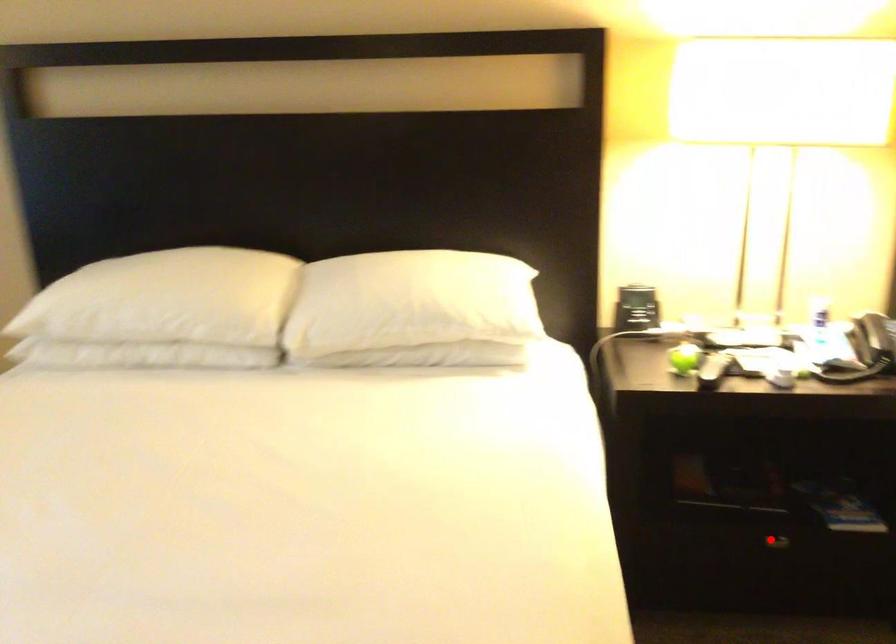
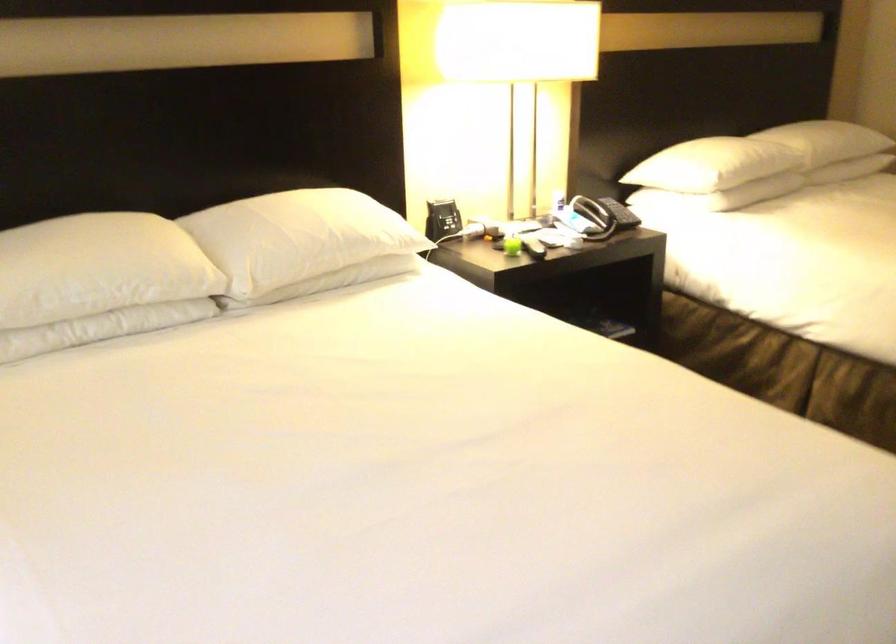
Question: I am providing you with two images of the same scene from different viewpoints. A red point is marked on the first image. Is the red point's position out of view in image 2?

Choices:
 (A) Yes
 (B) No

Answer: (A)